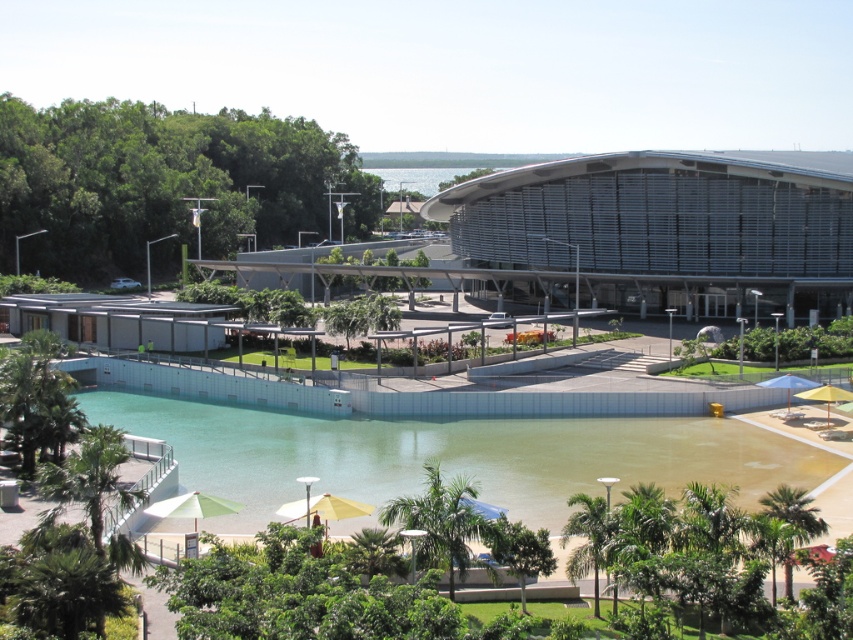
Question: Can you confirm if green leafy tree at upper left is positioned below green leafy palm tree at lower left?

Choices:
 (A) no
 (B) yes

Answer: (A)

Question: Estimate the real-world distances between objects in this image. Which object is closer to the green leafy palm tree at lower left?

Choices:
 (A) green concrete swimming pool at lower center
 (B) green leafy tree at upper left
 (C) green leafy tree at lower center

Answer: (C)

Question: Is metallic silver building at center to the left of green leafy palm tree at lower center from the viewer's perspective?

Choices:
 (A) no
 (B) yes

Answer: (A)

Question: Which object appears farthest from the camera in this image?

Choices:
 (A) green leafy tree at lower left
 (B) metallic silver building at center
 (C) green leafy tree at upper left

Answer: (C)

Question: Which point is closer to the camera taking this photo?

Choices:
 (A) (451, 492)
 (B) (494, 554)
 (C) (4, 241)
 (D) (67, 472)

Answer: (D)

Question: Can you confirm if green concrete swimming pool at lower center is positioned to the left of green leafy palm tree at lower center?

Choices:
 (A) no
 (B) yes

Answer: (B)